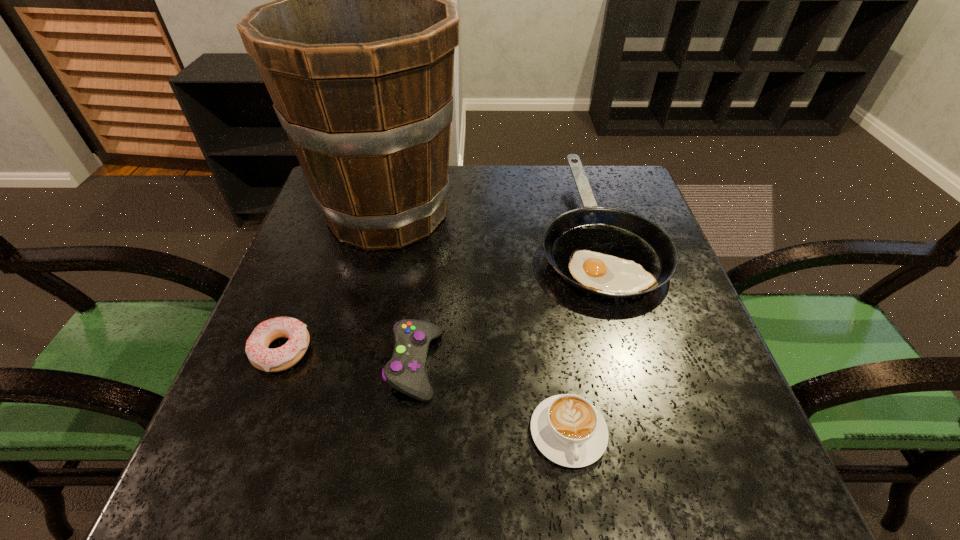
You are a GUI agent. You are given a task and a screenshot of the screen. Output one action in this format:
    pyautogui.click(x=<x>, y=<y>)
    Task: Click on the bucket
    
    Given the screenshot: What is the action you would take?
    pyautogui.click(x=357, y=51)

Identify the location of frying pan. This screenshot has height=540, width=960. (607, 252).

At what (x,y) coordinates should I click in order to perform the action: click on control. Please return your answer as a coordinate pair (x, y). Looking at the image, I should click on (405, 372).

Locate an element on the screen. This screenshot has height=540, width=960. cappuccino is located at coordinates (567, 429).

Locate an element on the screen. doughnut is located at coordinates (278, 359).

Image resolution: width=960 pixels, height=540 pixels. Find the location of `blank space located 0.150m on the right of the tallest object`. blank space located 0.150m on the right of the tallest object is located at coordinates (522, 212).

Locate an element on the screen. vacant space located 0.360m on the front of the frying pan is located at coordinates (672, 488).

Locate an element on the screen. This screenshot has width=960, height=540. vacant space located on the left of the control is located at coordinates (240, 364).

The width and height of the screenshot is (960, 540). I want to click on vacant space located on the back of the doughnut, so click(302, 298).

Locate an element on the screen. The width and height of the screenshot is (960, 540). bucket that is positioned at the far edge is located at coordinates (357, 51).